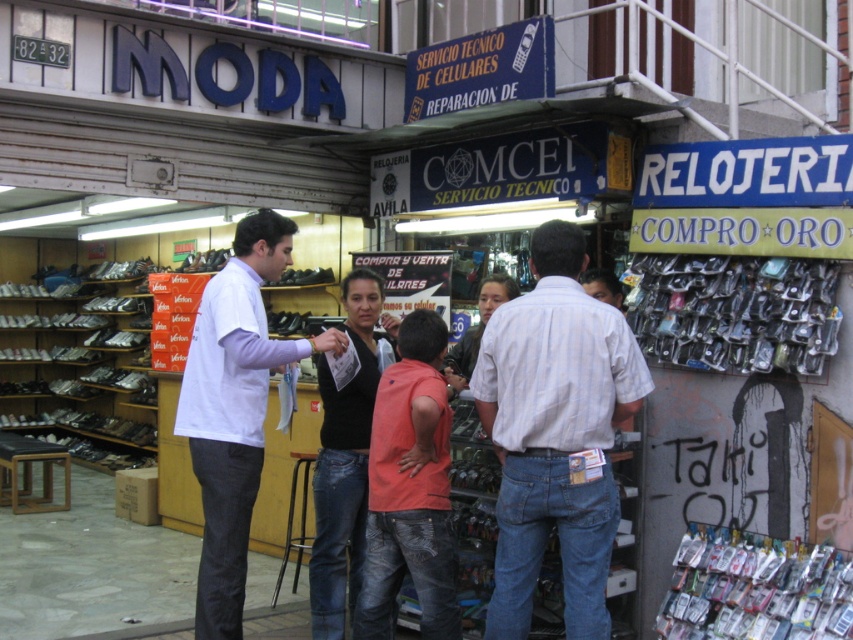
Can you confirm if striped cotton shirt at center is wider than black matte shirt at center?

Yes.

Find the location of `striped cotton shirt at center`. striped cotton shirt at center is located at coordinates (555, 433).

Can you confirm if white cotton shirt at center is positioned to the left of black leather jacket at center?

Indeed, white cotton shirt at center is positioned on the left side of black leather jacket at center.

Between white cotton shirt at center and black leather jacket at center, which one appears on the left side from the viewer's perspective?

white cotton shirt at center

Where is `white cotton shirt at center`? This screenshot has width=853, height=640. white cotton shirt at center is located at coordinates [x=234, y=408].

Who is more forward, (326, 616) or (451, 387)?

Point (326, 616)

Can you confirm if black matte shirt at center is shorter than black leather jacket at center?

In fact, black matte shirt at center may be taller than black leather jacket at center.

Who is more forward, (366, 461) or (503, 301)?

Point (366, 461) is in front.

This screenshot has height=640, width=853. Identify the location of black matte shirt at center. (344, 461).